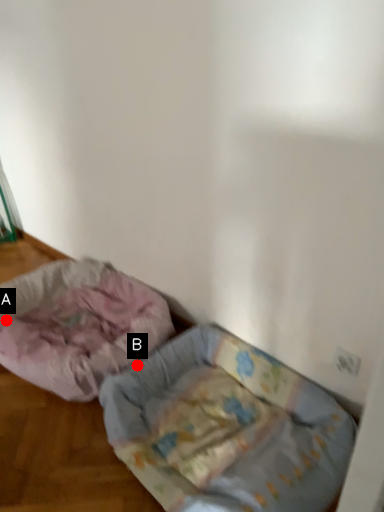
Question: Two points are circled on the image, labeled by A and B beside each circle. Which point is closer to the camera?

Choices:
 (A) A is closer
 (B) B is closer

Answer: (B)